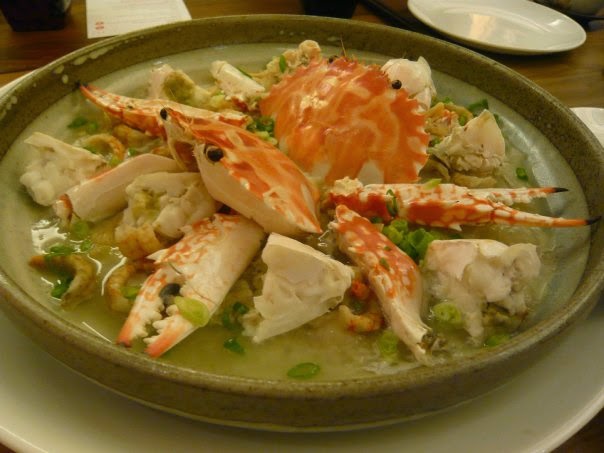
Image resolution: width=604 pixels, height=453 pixels. What are the coordinates of `plate` in the screenshot? It's located at (509, 418).